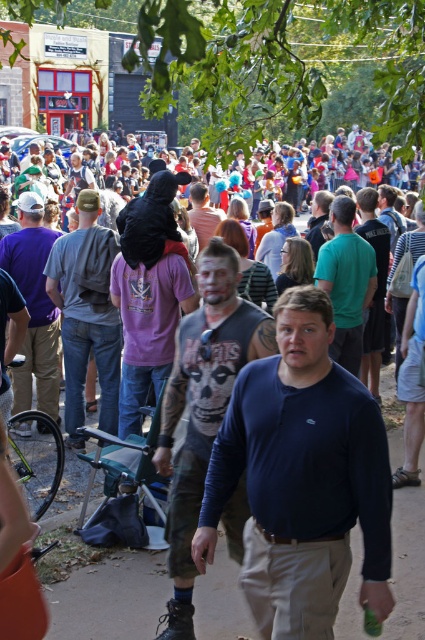
Between dark blue long-sleeve shirt at center and denim jeans at center, which one appears on the right side from the viewer's perspective?

dark blue long-sleeve shirt at center

Is dark blue long-sleeve shirt at center to the left of denim jeans at center from the viewer's perspective?

In fact, dark blue long-sleeve shirt at center is to the right of denim jeans at center.

Between point (292, 417) and point (85, 317), which one is positioned in front?

Point (292, 417)

Find the location of a particular element. dark blue long-sleeve shirt at center is located at coordinates (302, 480).

Between dark blue long-sleeve shirt at center and matte black shirt at center, which one appears on the left side from the viewer's perspective?

dark blue long-sleeve shirt at center is more to the left.

Locate an element on the screen. dark blue long-sleeve shirt at center is located at coordinates (302, 480).

Measure the distance between dark blue long-sleeve shirt at center and camera.

3.22 meters

Where is `dark blue long-sleeve shirt at center`? dark blue long-sleeve shirt at center is located at coordinates (302, 480).

Looking at this image, between purple cotton t-shirt at center and matte black shirt at center, which one has less height?

purple cotton t-shirt at center

Does purple cotton t-shirt at center come behind matte black shirt at center?

No.

Image resolution: width=425 pixels, height=640 pixels. What are the coordinates of `purple cotton t-shirt at center` in the screenshot? It's located at (34, 307).

You are a GUI agent. You are given a task and a screenshot of the screen. Output one action in this format:
    pyautogui.click(x=<x>, y=<y>)
    Task: Click on the purple cotton t-shirt at center
    
    Given the screenshot: What is the action you would take?
    pyautogui.click(x=34, y=307)